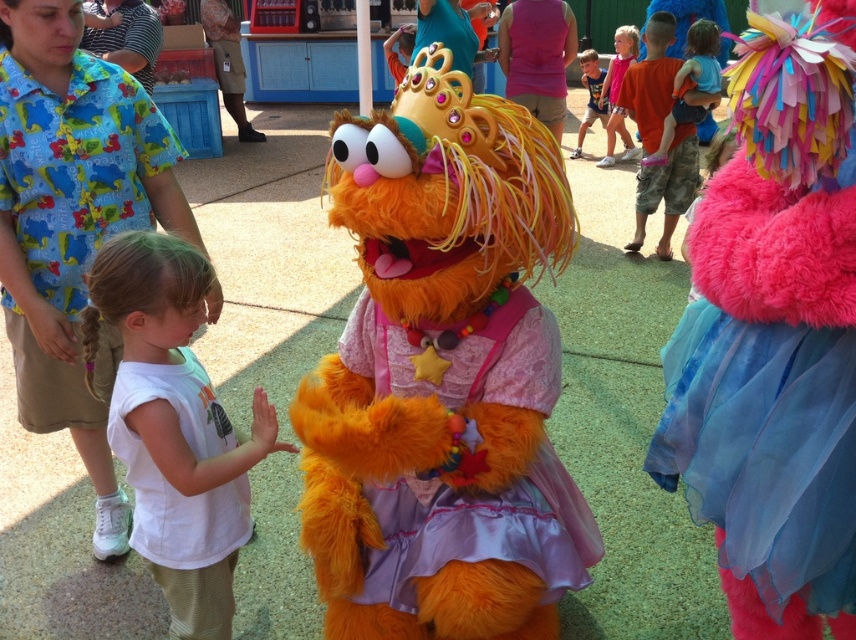
This screenshot has width=856, height=640. Identify the location of fluffy orange fur at center. (444, 380).

Who is lower down, fluffy orange fur at center or orange furry costume at left?

fluffy orange fur at center

Does point (545, 564) lie behind point (102, 378)?

No, it is not.

Where is `fluffy orange fur at center`? fluffy orange fur at center is located at coordinates (444, 380).

Who is lower down, orange furry costume at left or blue fabric shirt at upper right?

orange furry costume at left is below.

Can you confirm if orange furry costume at left is positioned above blue fabric shirt at upper right?

No.

This screenshot has height=640, width=856. Describe the element at coordinates (72, 214) in the screenshot. I see `orange furry costume at left` at that location.

Find the location of a particular element. orange furry costume at left is located at coordinates (72, 214).

Measure the distance from white cotton shirt at center to orange furry costume at left.

white cotton shirt at center and orange furry costume at left are 22.14 inches apart.

Consider the image. Which is below, white cotton shirt at center or orange furry costume at left?

white cotton shirt at center is below.

Is point (141, 529) more distant than point (51, 195)?

No, it is in front of (51, 195).

Where is `white cotton shirt at center`? The image size is (856, 640). white cotton shirt at center is located at coordinates (174, 426).